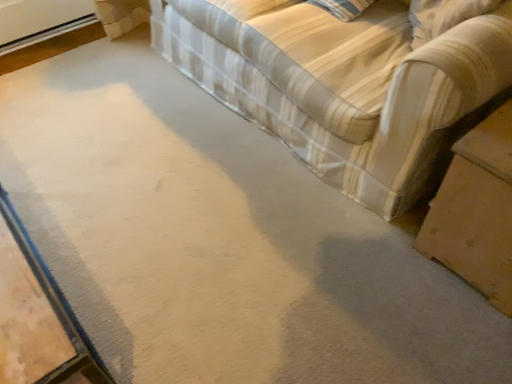
Locate an element on the screen. The height and width of the screenshot is (384, 512). wooden table at lower right is located at coordinates (476, 211).

Describe the element at coordinates (476, 211) in the screenshot. I see `wooden table at lower right` at that location.

Describe the element at coordinates (343, 84) in the screenshot. I see `striped fabric couch at upper right` at that location.

Identify the location of striped fabric couch at upper right. (343, 84).

Measure the distance between striped fabric couch at upper right and camera.

A distance of 1.05 meters exists between striped fabric couch at upper right and camera.

Where is `wooden table at lower right`? The image size is (512, 384). wooden table at lower right is located at coordinates (476, 211).

Which is more to the right, wooden table at lower right or striped fabric couch at upper right?

Positioned to the right is wooden table at lower right.

Which object is closer to the camera, wooden table at lower right or striped fabric couch at upper right?

striped fabric couch at upper right is more forward.

Is point (490, 273) farther from camera compared to point (399, 59)?

No, it is not.

From the image's perspective, is wooden table at lower right located above or below striped fabric couch at upper right?

wooden table at lower right is below striped fabric couch at upper right.

From a real-world perspective, which object stands above the other?

In real-world perspective, striped fabric couch at upper right is above.

Can you confirm if wooden table at lower right is thinner than striped fabric couch at upper right?

Correct, the width of wooden table at lower right is less than that of striped fabric couch at upper right.

Looking at this image, is wooden table at lower right taller than striped fabric couch at upper right?

Incorrect, the height of wooden table at lower right is not larger of that of striped fabric couch at upper right.

Is wooden table at lower right bigger than striped fabric couch at upper right?

Actually, wooden table at lower right might be smaller than striped fabric couch at upper right.

Can we say wooden table at lower right lies outside striped fabric couch at upper right?

Yes, wooden table at lower right is outside of striped fabric couch at upper right.

Looking at this image, is wooden table at lower right positioned far away from striped fabric couch at upper right?

They are positioned close to each other.

Does wooden table at lower right turn towards striped fabric couch at upper right?

No, wooden table at lower right is not facing towards striped fabric couch at upper right.

In the scene shown: Can you tell me how much wooden table at lower right and striped fabric couch at upper right differ in facing direction?

They differ by 90.3 degrees in their facing directions.

Identify the location of studio couch above the wooden table at lower right (from the image's perspective). (343, 84).

In the image, is striped fabric couch at upper right on the left side or the right side of wooden table at lower right?

striped fabric couch at upper right is positioned on wooden table at lower right's left side.

Which object is further away from the camera, striped fabric couch at upper right or wooden table at lower right?

wooden table at lower right is further away from the camera.

Which is less distant, (509, 9) or (506, 294)?

Point (509, 9) is positioned farther from the camera compared to point (506, 294).

From the image's perspective, would you say striped fabric couch at upper right is shown under wooden table at lower right?

No, from the image's perspective, striped fabric couch at upper right is not below wooden table at lower right.

From a real-world perspective, which object rests below the other?

wooden table at lower right is physically lower.

Considering the sizes of objects striped fabric couch at upper right and wooden table at lower right in the image provided, who is wider, striped fabric couch at upper right or wooden table at lower right?

striped fabric couch at upper right is wider.

Based on the photo, considering the sizes of objects striped fabric couch at upper right and wooden table at lower right in the image provided, who is shorter, striped fabric couch at upper right or wooden table at lower right?

wooden table at lower right.

Which of these two, striped fabric couch at upper right or wooden table at lower right, is smaller?

wooden table at lower right.

Is striped fabric couch at upper right not within wooden table at lower right?

That's correct, striped fabric couch at upper right is outside of wooden table at lower right.

Is striped fabric couch at upper right in contact with wooden table at lower right?

No, striped fabric couch at upper right is not beside wooden table at lower right.

Is striped fabric couch at upper right oriented towards wooden table at lower right?

No, striped fabric couch at upper right is not oriented towards wooden table at lower right.

How different are the orientations of striped fabric couch at upper right and wooden table at lower right in degrees?

The angle between the facing direction of striped fabric couch at upper right and the facing direction of wooden table at lower right is 90.3 degrees.

You are a GUI agent. You are given a task and a screenshot of the screen. Output one action in this format:
    pyautogui.click(x=<x>, y=<y>)
    Task: Click on the table below the striped fabric couch at upper right (from a real-world perspective)
    
    Given the screenshot: What is the action you would take?
    pyautogui.click(x=476, y=211)

Identify the location of studio couch lying on the left of wooden table at lower right. Image resolution: width=512 pixels, height=384 pixels. (343, 84).

Locate an element on the screen. table on the right of striped fabric couch at upper right is located at coordinates (476, 211).